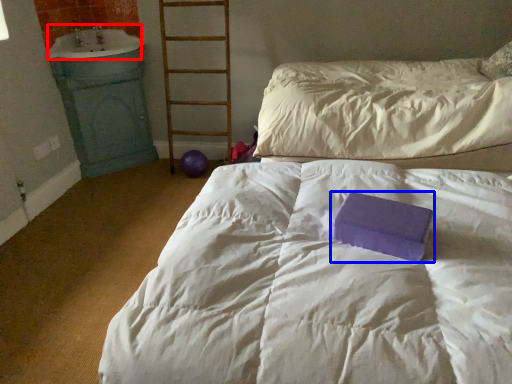
Question: Which object appears closest to the camera in this image, sink (highlighted by a red box) or paperback book (highlighted by a blue box)?

Choices:
 (A) sink
 (B) paperback book

Answer: (B)